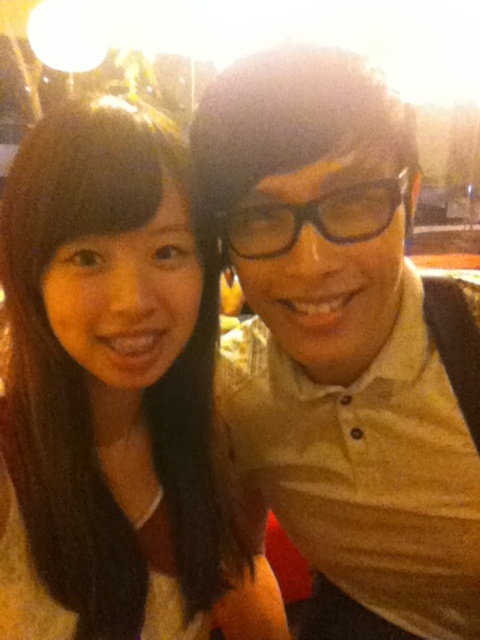
Can you confirm if matte beige polo shirt at center is positioned below matte brown hair at left?

No.

Can you confirm if matte beige polo shirt at center is positioned to the left of matte brown hair at left?

Incorrect, matte beige polo shirt at center is not on the left side of matte brown hair at left.

Identify the location of matte beige polo shirt at center. The height and width of the screenshot is (640, 480). (346, 342).

Does matte beige polo shirt at center appear under black plastic glasses at center?

Yes.

Image resolution: width=480 pixels, height=640 pixels. Identify the location of matte beige polo shirt at center. (346, 342).

Locate an element on the screen. matte beige polo shirt at center is located at coordinates (346, 342).

Looking at this image, does matte brown hair at left appear under black plastic glasses at center?

Correct, matte brown hair at left is located below black plastic glasses at center.

Describe the element at coordinates (113, 400) in the screenshot. The image size is (480, 640). I see `matte brown hair at left` at that location.

Where is `matte brown hair at left`? The width and height of the screenshot is (480, 640). matte brown hair at left is located at coordinates (113, 400).